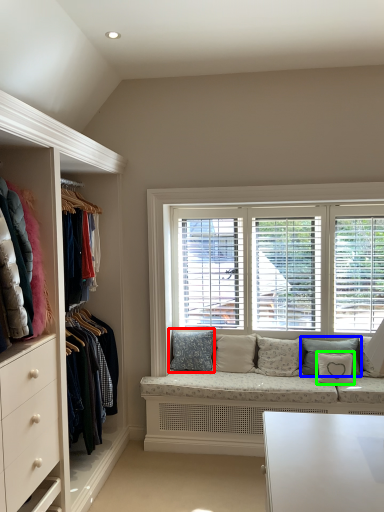
Question: Which is farther away from pillow (highlighted by a red box)? pillow (highlighted by a blue box) or pillow (highlighted by a green box)?

Choices:
 (A) pillow
 (B) pillow

Answer: (B)